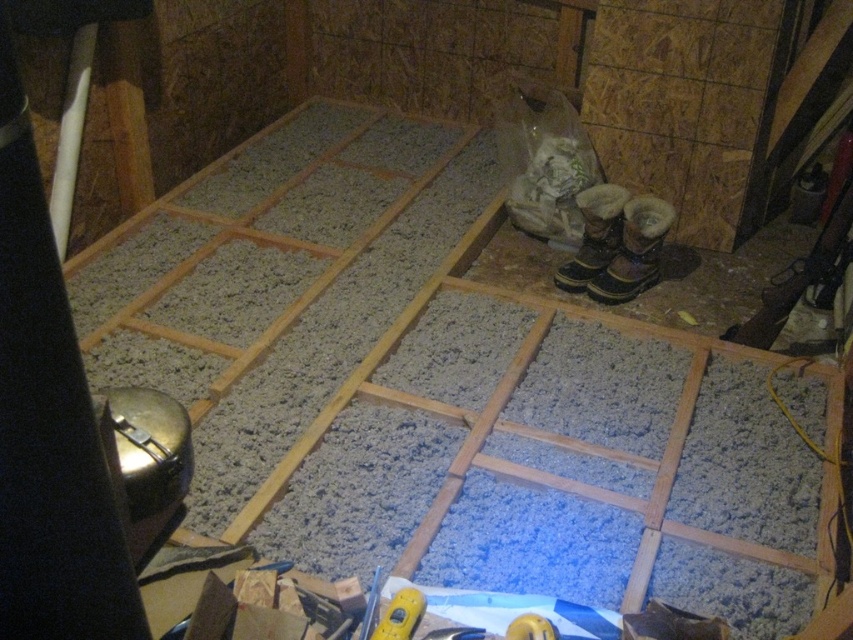
Does point (624, 248) lie in front of point (535, 625)?

No, (624, 248) is behind (535, 625).

Consider the image. Is brown leather boot at right shorter than yellow plastic tool at lower center?

Incorrect, brown leather boot at right's height does not fall short of yellow plastic tool at lower center's.

Is point (651, 273) farther from viewer compared to point (531, 637)?

That is True.

Locate an element on the screen. Image resolution: width=853 pixels, height=640 pixels. brown leather boot at right is located at coordinates (634, 252).

Does brown suede boot at center have a greater height compared to yellow plastic tool at lower center?

Correct, brown suede boot at center is much taller as yellow plastic tool at lower center.

Does brown suede boot at center have a greater width compared to yellow plastic tool at lower center?

Indeed, brown suede boot at center has a greater width compared to yellow plastic tool at lower center.

Between point (590, 225) and point (520, 618), which one is positioned behind?

The point (590, 225) is more distant.

In order to click on brown suede boot at center in this screenshot , I will do `click(595, 236)`.

Can you confirm if yellow plastic tape measure at lower center is positioned above yellow plastic tool at lower center?

Indeed, yellow plastic tape measure at lower center is positioned over yellow plastic tool at lower center.

Which is behind, point (384, 620) or point (520, 616)?

The point (520, 616) is more distant.

Locate an element on the screen. The height and width of the screenshot is (640, 853). yellow plastic tape measure at lower center is located at coordinates (399, 616).